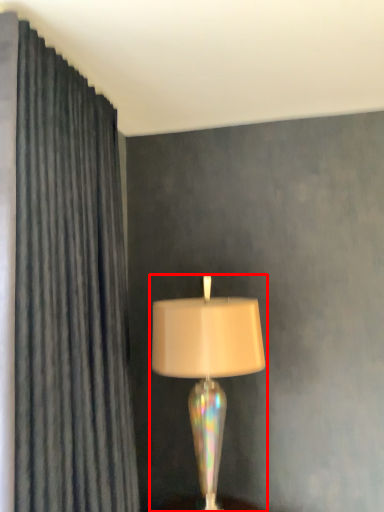
Question: From the image's perspective, considering the relative positions of lamp (annotated by the red box) and curtain in the image provided, where is lamp (annotated by the red box) located with respect to the staircase?

Choices:
 (A) above
 (B) below

Answer: (B)